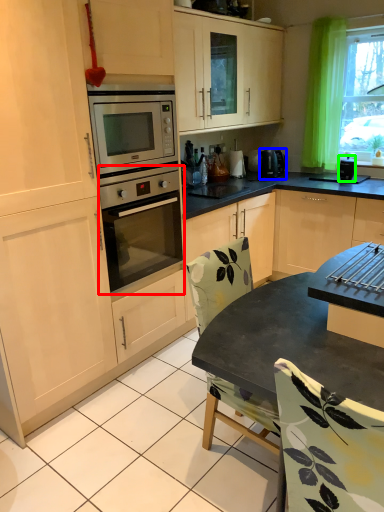
Question: Based on their relative distances, which object is farther from oven (highlighted by a red box)? Choose from kitchen appliance (highlighted by a blue box) and appliance (highlighted by a green box).

Choices:
 (A) kitchen appliance
 (B) appliance

Answer: (B)